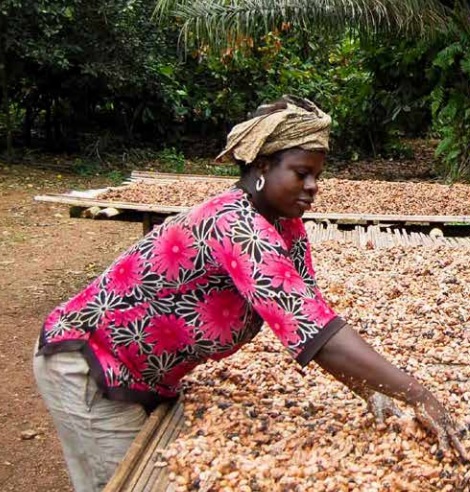
The width and height of the screenshot is (470, 492). I want to click on drying tables, so click(x=356, y=201), click(x=385, y=307).